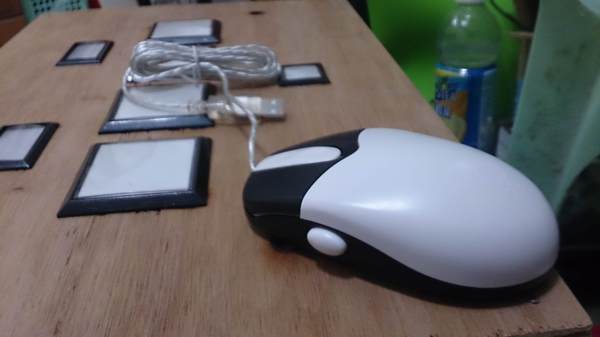
The height and width of the screenshot is (337, 600). What are the coordinates of `floor or wall` in the screenshot? It's located at (12, 12).